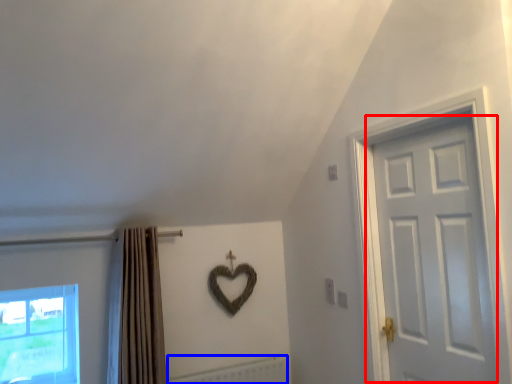
Question: Which object appears farthest to the camera in this image, door (highlighted by a red box) or radiator (highlighted by a blue box)?

Choices:
 (A) door
 (B) radiator

Answer: (B)